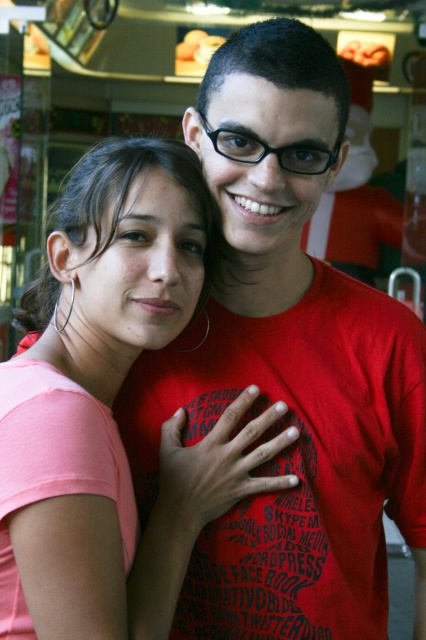
Between matte red t-shirt at center and pink matte shirt at center, which one appears on the left side from the viewer's perspective?

pink matte shirt at center

What do you see at coordinates (287, 365) in the screenshot?
I see `matte red t-shirt at center` at bounding box center [287, 365].

The image size is (426, 640). In order to click on matte red t-shirt at center in this screenshot , I will do `click(287, 365)`.